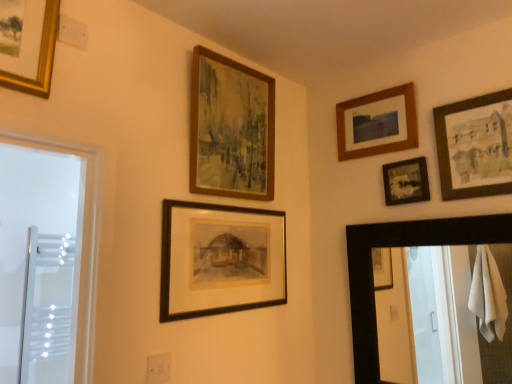
Question: Based on their positions, is transparent glass screen door at left located to the left or right of matte black picture frame at center, the fifth picture frame when ordered from right to left?

Choices:
 (A) left
 (B) right

Answer: (A)

Question: From the image's perspective, relative to matte black picture frame at center, the fifth picture frame when ordered from right to left, is transparent glass screen door at left above or below?

Choices:
 (A) above
 (B) below

Answer: (B)

Question: Considering the real-world distances, which object is farthest from the black wooden mirror at right?

Choices:
 (A) matte black picture frame at center, the fifth picture frame when ordered from right to left
 (B) matte black picture frame at upper right, which is the fourth picture frame from left to right
 (C) wooden framed painting at upper right, marked as the fifth picture frame in a left-to-right arrangement
 (D) wooden frame at upper right, arranged as the 3th picture frame when viewed from the right
 (E) transparent glass screen door at left

Answer: (E)

Question: Considering the real-world distances, which object is closest to the matte black picture frame at center, the fifth picture frame when ordered from right to left?

Choices:
 (A) transparent glass screen door at left
 (B) wooden frame at upper right, arranged as the 3th picture frame when viewed from the right
 (C) wooden framed painting at upper right, marked as the fifth picture frame in a left-to-right arrangement
 (D) matte black picture frame at upper right, which appears as the 2th picture frame when viewed from the right
 (E) black wooden mirror at right

Answer: (E)